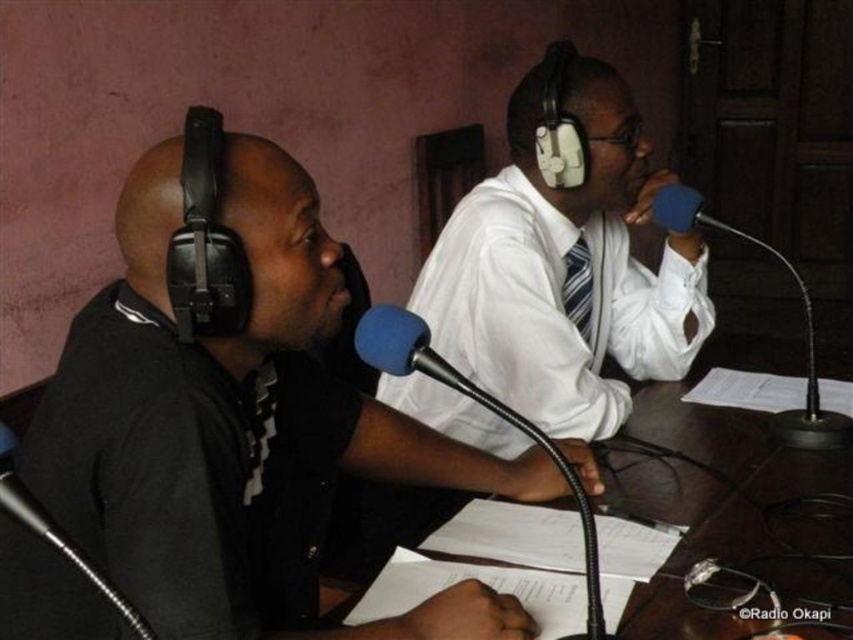
Question: Is white paper at center wider than striped fabric tie at center?

Choices:
 (A) yes
 (B) no

Answer: (A)

Question: Considering the real-world distances, which object is farthest from the white paper at center?

Choices:
 (A) striped fabric tie at center
 (B) white glossy shirt at center
 (C) blue foam microphone at center

Answer: (C)

Question: Estimate the real-world distances between objects in this image. Which object is farther from the blue foam microphone at center?

Choices:
 (A) white paper at center
 (B) blue foam microphone at right
 (C) striped fabric tie at center

Answer: (A)

Question: Which of the following is the farthest from the observer?

Choices:
 (A) blue foam microphone at center
 (B) striped fabric tie at center

Answer: (B)

Question: Is white glossy shirt at center smaller than blue foam microphone at right?

Choices:
 (A) no
 (B) yes

Answer: (A)

Question: Where is white glossy shirt at center located in relation to striped fabric tie at center in the image?

Choices:
 (A) above
 (B) below

Answer: (A)